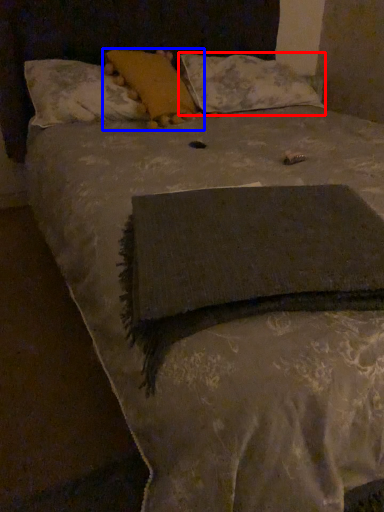
Question: Among these objects, which one is farthest to the camera, pillow (highlighted by a red box) or pillow (highlighted by a blue box)?

Choices:
 (A) pillow
 (B) pillow

Answer: (A)